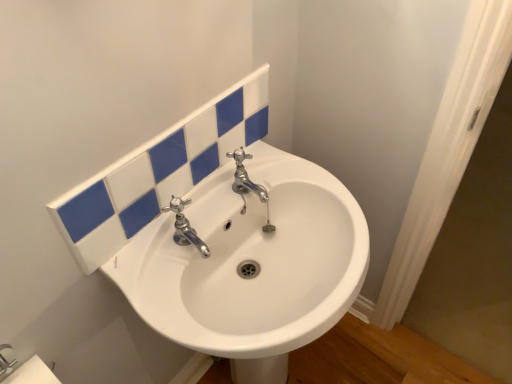
Question: Considering the positions of white glossy sink at center and chrome/metallic faucet at center in the image, is white glossy sink at center wider or thinner than chrome/metallic faucet at center?

Choices:
 (A) wide
 (B) thin

Answer: (A)

Question: Does point (282, 278) appear closer or farther from the camera than point (186, 220)?

Choices:
 (A) farther
 (B) closer

Answer: (A)

Question: Based on their relative distances, which object is farther from the white glossy sink at center?

Choices:
 (A) chrome/metallic faucet at center
 (B) white matte toilet paper at lower left
 (C) white glossy tiles at upper center

Answer: (B)

Question: Considering the real-world distances, which object is closest to the white glossy tiles at upper center?

Choices:
 (A) white glossy sink at center
 (B) white matte toilet paper at lower left
 (C) chrome/metallic faucet at center

Answer: (C)